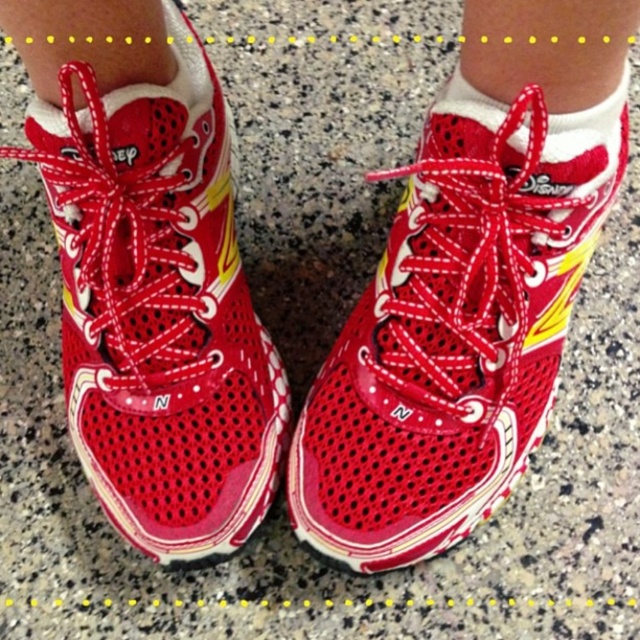
Question: Is matte mesh shoe at center further to camera compared to white soft sock at center?

Choices:
 (A) yes
 (B) no

Answer: (B)

Question: Can you confirm if shiny red mesh shoe at center is positioned to the left of white soft sock at center?

Choices:
 (A) no
 (B) yes

Answer: (B)

Question: Which of these objects is positioned closest to the shiny red mesh shoe at center?

Choices:
 (A) white soft sock at center
 (B) matte mesh shoe at center

Answer: (A)

Question: Which point appears farthest from the camera in this image?

Choices:
 (A) (131, 228)
 (B) (477, 108)
 (C) (422, 291)

Answer: (C)

Question: Which point is closer to the camera?

Choices:
 (A) shiny red mesh shoe at center
 (B) white soft sock at center

Answer: (A)

Question: Is matte mesh shoe at center bigger than white soft sock at center?

Choices:
 (A) no
 (B) yes

Answer: (B)